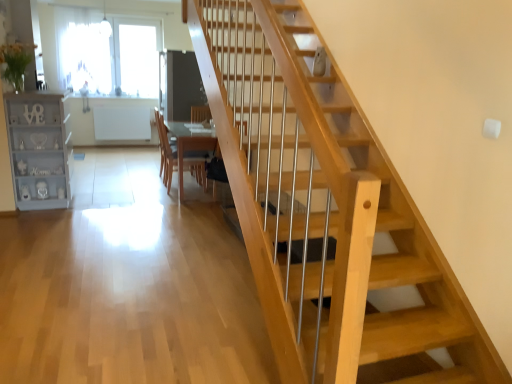
Question: Is wooden at center taller than transparent glass window at upper left?

Choices:
 (A) no
 (B) yes

Answer: (A)

Question: Considering the relative sizes of wooden at center and transparent glass window at upper left in the image provided, is wooden at center shorter than transparent glass window at upper left?

Choices:
 (A) yes
 (B) no

Answer: (A)

Question: Is wooden at center positioned behind transparent glass window at upper left?

Choices:
 (A) yes
 (B) no

Answer: (B)

Question: Is wooden at center aimed at transparent glass window at upper left?

Choices:
 (A) no
 (B) yes

Answer: (A)

Question: From the image's perspective, is wooden at center on transparent glass window at upper left?

Choices:
 (A) yes
 (B) no

Answer: (B)

Question: Does wooden at center contain transparent glass window at upper left?

Choices:
 (A) yes
 (B) no

Answer: (B)

Question: Is wooden at center at the back of light gray painted wood bookshelf at left?

Choices:
 (A) yes
 (B) no

Answer: (B)

Question: Does light gray painted wood bookshelf at left have a lesser width compared to wooden at center?

Choices:
 (A) yes
 (B) no

Answer: (B)

Question: Is light gray painted wood bookshelf at left at the right side of wooden at center?

Choices:
 (A) no
 (B) yes

Answer: (A)

Question: From a real-world perspective, is light gray painted wood bookshelf at left on top of wooden at center?

Choices:
 (A) yes
 (B) no

Answer: (A)

Question: Does light gray painted wood bookshelf at left have a smaller size compared to wooden at center?

Choices:
 (A) no
 (B) yes

Answer: (A)

Question: Does light gray painted wood bookshelf at left come in front of wooden at center?

Choices:
 (A) no
 (B) yes

Answer: (B)

Question: Is wooden at center closer to the viewer compared to light gray painted wood bookshelf at left?

Choices:
 (A) no
 (B) yes

Answer: (A)